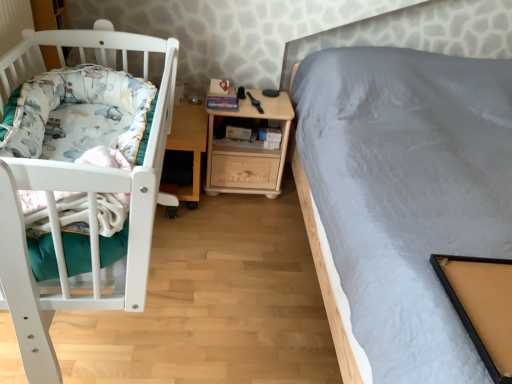
Question: Does white soft blanket at left have a greater height compared to wooden nightstand at center?

Choices:
 (A) no
 (B) yes

Answer: (A)

Question: Are white soft blanket at left and wooden nightstand at center beside each other?

Choices:
 (A) no
 (B) yes

Answer: (A)

Question: Would you consider white soft blanket at left to be distant from wooden nightstand at center?

Choices:
 (A) no
 (B) yes

Answer: (A)

Question: From the image's perspective, is white soft blanket at left beneath wooden nightstand at center?

Choices:
 (A) no
 (B) yes

Answer: (B)

Question: Is white soft blanket at left oriented towards wooden nightstand at center?

Choices:
 (A) yes
 (B) no

Answer: (B)

Question: In terms of width, does wooden nightstand at center look wider or thinner when compared to white soft blanket at left?

Choices:
 (A) thin
 (B) wide

Answer: (A)

Question: Visually, is wooden nightstand at center positioned to the left or to the right of white soft blanket at left?

Choices:
 (A) right
 (B) left

Answer: (A)

Question: Is point (254, 152) closer or farther from the camera than point (66, 69)?

Choices:
 (A) closer
 (B) farther

Answer: (B)

Question: In the image, is wooden nightstand at center positioned in front of or behind white soft blanket at left?

Choices:
 (A) front
 (B) behind

Answer: (B)

Question: Considering the positions of wooden table at center and white soft blanket at left in the image, is wooden table at center taller or shorter than white soft blanket at left?

Choices:
 (A) tall
 (B) short

Answer: (A)

Question: Is point (174, 139) positioned closer to the camera than point (118, 115)?

Choices:
 (A) closer
 (B) farther

Answer: (B)

Question: Based on their sizes in the image, would you say wooden table at center is bigger or smaller than white soft blanket at left?

Choices:
 (A) big
 (B) small

Answer: (B)

Question: Considering the positions of wooden table at center and white soft blanket at left in the image, is wooden table at center wider or thinner than white soft blanket at left?

Choices:
 (A) wide
 (B) thin

Answer: (A)

Question: In the image, is white soft blanket at left on the left side or the right side of wooden nightstand at center?

Choices:
 (A) right
 (B) left

Answer: (B)

Question: Considering the positions of point (70, 89) and point (287, 127), is point (70, 89) closer or farther from the camera than point (287, 127)?

Choices:
 (A) closer
 (B) farther

Answer: (A)